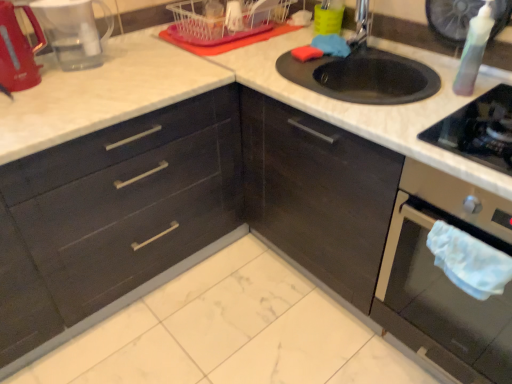
You are a GUI agent. You are given a task and a screenshot of the screen. Output one action in this format:
    pyautogui.click(x=<x>, y=<y>)
    Task: Click on the vacant area located to the right-hand side of metallic red kettle at left, which is the second appliance from right to left
    
    Given the screenshot: What is the action you would take?
    pyautogui.click(x=72, y=86)